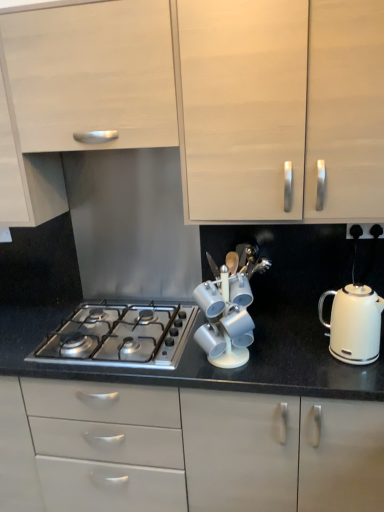
Question: Do you think stainless steel gas stove at center is within white matte cabinet at upper center, the 2th cabinetry when ordered from bottom to top, or outside of it?

Choices:
 (A) outside
 (B) inside

Answer: (A)

Question: Would you say stainless steel gas stove at center is to the left or to the right of white matte cabinet at upper center, the 2th cabinetry when ordered from bottom to top, in the picture?

Choices:
 (A) right
 (B) left

Answer: (B)

Question: Which object is positioned closest to the stainless steel gas stove at center?

Choices:
 (A) white glossy cup at center
 (B) white matte cabinet at center, the 1th cabinetry in the bottom-to-top sequence
 (C) white glossy kettle at right
 (D) white matte cabinet at upper left, arranged as the 4th cabinetry when ordered from the bottom
 (E) white matte cabinet at upper center, the 2th cabinetry when ordered from bottom to top

Answer: (A)

Question: Which object is the closest to the white matte cabinet at upper center, which is counted as the third cabinetry, starting from the top?

Choices:
 (A) white glossy kettle at right
 (B) white matte cabinet at center, which appears as the fourth cabinetry when viewed from the top
 (C) white glossy cup at center
 (D) stainless steel gas stove at center
 (E) white matte cabinet at upper left, arranged as the 4th cabinetry when ordered from the bottom

Answer: (E)